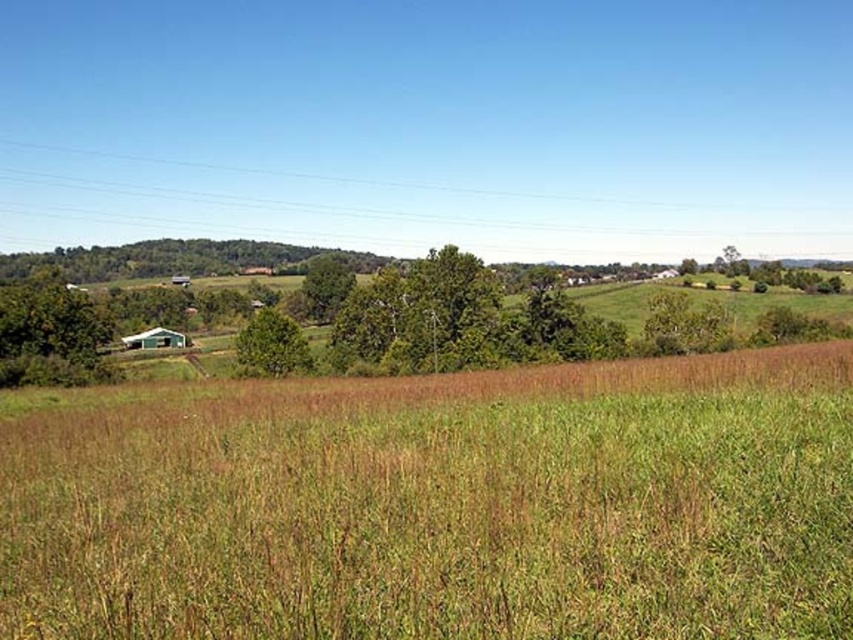
You are a drone operator and need to fly a drone from the field of tall grasses in the foreground to the small teal barn in the middle ground. The brown wooden power line at upper center is in your flight path. According to the coordinates provided, will the drone have to adjust its path to avoid the power line?

The brown wooden power line at upper center is located at point (325, 205), so the drone will need to adjust its path to avoid the power line as it lies along the flight path between the field of tall grasses and the teal barn.

You are a bird flying over the rural landscape. You see the brown wooden power line at upper center and the green matte tree at left. Which object appears larger from your perspective?

The brown wooden power line at upper center appears larger than the green matte tree at left because it is bigger in size.

You are a bird looking for a higher perch to survey the landscape. Which tree would you choose between the green matte tree at left and the green leafy tree at center?

The green matte tree at left is much taller than the green leafy tree at center, so the bird should choose the green matte tree at left for a higher perch.